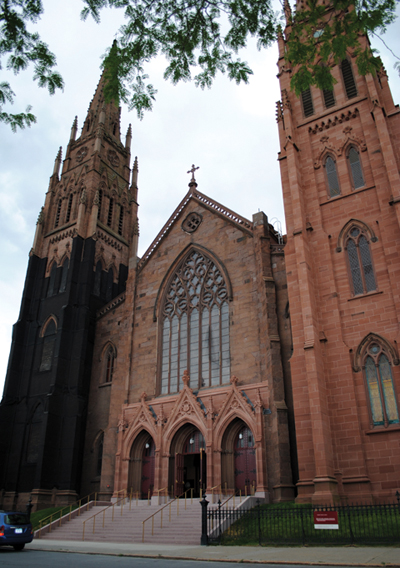
Identify the location of door. The width and height of the screenshot is (400, 568). (250, 460).